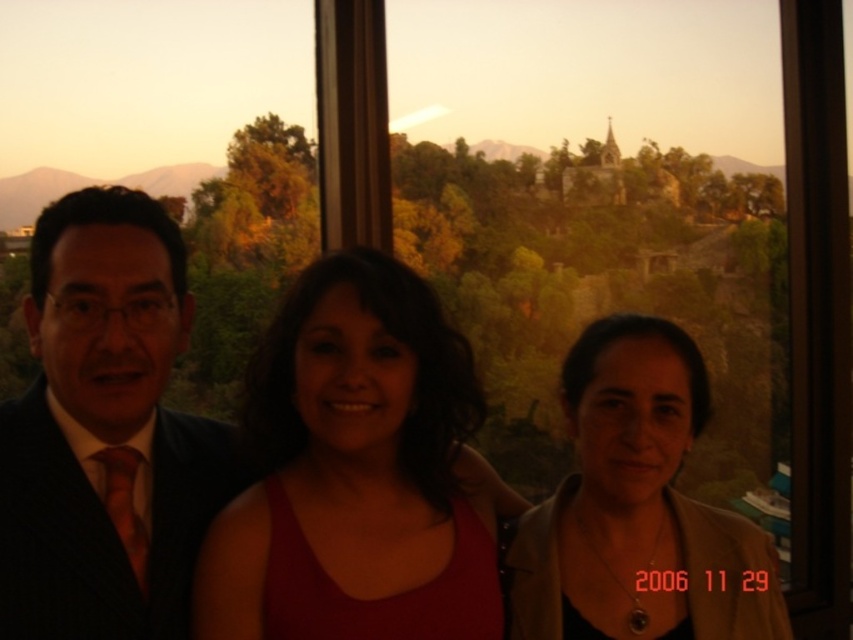
You are a photographer setting up for a group photo. You need to ensure that the matte red tank top at center and the matte beige jacket at lower right are both visible in the frame. Based on their positions, which one is closer to the bottom of the image?

The matte beige jacket at lower right is closer to the bottom of the image because it is positioned below the matte red tank top at center.

You are a photographer trying to adjust the lighting for a group photo. You notice the dark blue suit at left and the matte beige jacket at lower right. Which one is closer to the camera?

The dark blue suit at left is closer to the camera since it is in front of the matte beige jacket at lower right.

You are a photographer adjusting the camera settings for a group photo. The scene includes a matte red tank top at center and a matte beige jacket at lower right. Which object should you focus on first if you want to ensure both are in focus, considering their heights?

The matte red tank top at center is much taller than the matte beige jacket at lower right, so you should focus on the matte red tank top at center first to ensure both are in focus.